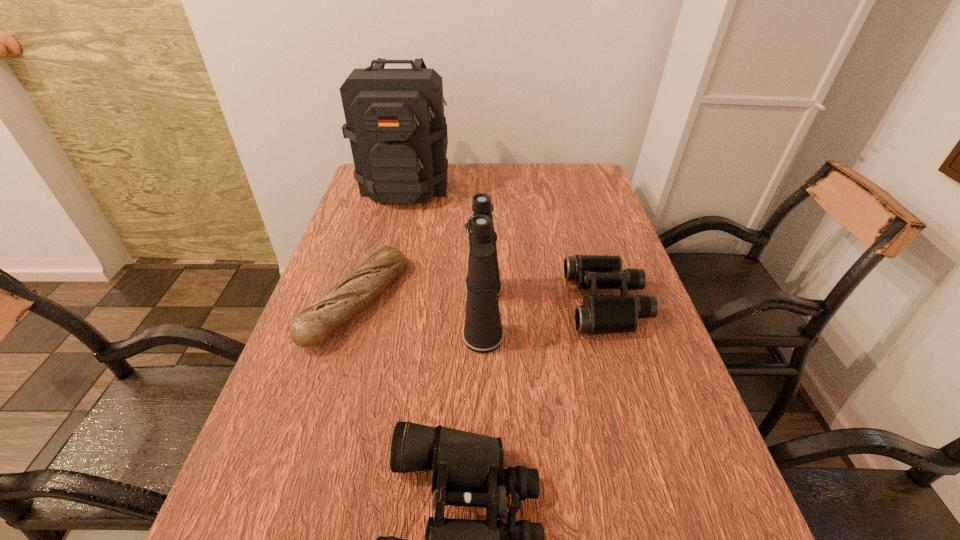
Image resolution: width=960 pixels, height=540 pixels. I want to click on vacant area between the tallest binoculars and the farthest object, so click(445, 249).

The image size is (960, 540). I want to click on free space that is in between the tallest object and the tallest binoculars, so click(445, 249).

Where is `vacant space that is in between the baguet and the tallest binoculars`? This screenshot has width=960, height=540. vacant space that is in between the baguet and the tallest binoculars is located at coordinates (420, 308).

Identify the location of vacant area between the farthest object and the rightmost binoculars. The height and width of the screenshot is (540, 960). (507, 244).

Locate an element on the screen. This screenshot has height=540, width=960. object that stands as the second closest to the rightmost binoculars is located at coordinates (467, 469).

Select which object appears as the closest to the farthest object. Please provide its 2D coordinates. Your answer should be formatted as a tuple, i.e. [(x, y)], where the tuple contains the x and y coordinates of a point satisfying the conditions above.

[(350, 295)]

Find the location of a particular element. This screenshot has height=540, width=960. binoculars that is the third nearest to the baguet is located at coordinates (599, 314).

Locate an element on the screen. binoculars identified as the closest to the fourth shortest object is located at coordinates (599, 314).

Where is `vacant space that satisfies the following two spatial constraints: 1. on the front compartment of the tallest object; 2. on the left side of the fourth shortest object`? This screenshot has width=960, height=540. vacant space that satisfies the following two spatial constraints: 1. on the front compartment of the tallest object; 2. on the left side of the fourth shortest object is located at coordinates (374, 314).

Where is `free location that satisfies the following two spatial constraints: 1. on the front-facing side of the rightmost binoculars; 2. on the front side of the tallest binoculars`? This screenshot has height=540, width=960. free location that satisfies the following two spatial constraints: 1. on the front-facing side of the rightmost binoculars; 2. on the front side of the tallest binoculars is located at coordinates (611, 314).